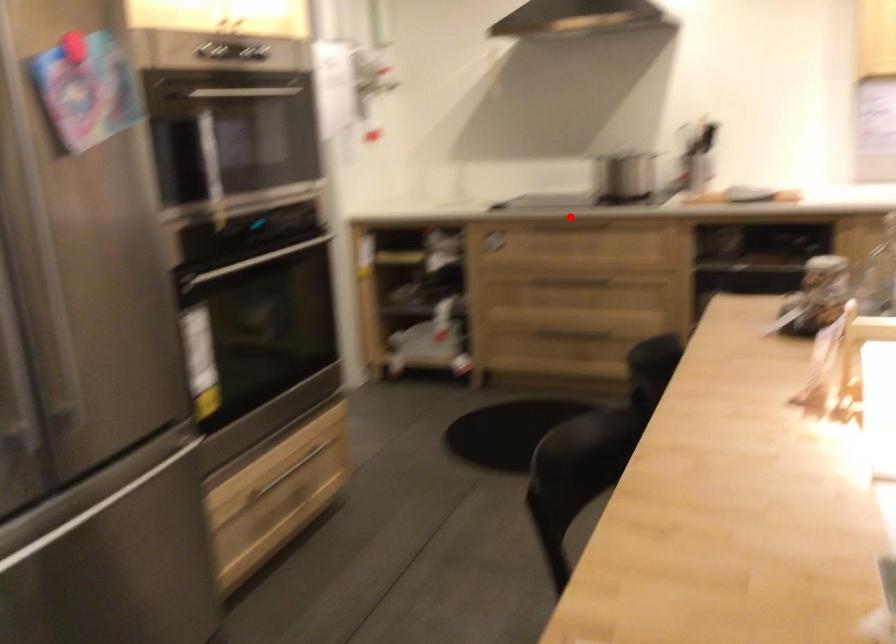
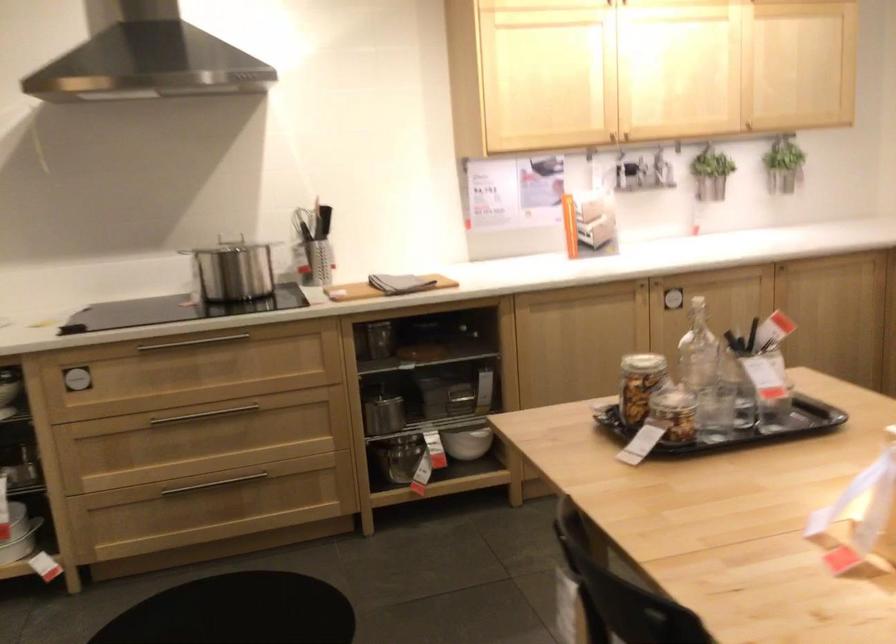
Locate, in the second image, the point that corresponds to the highlighted location in the first image.

(194, 343)